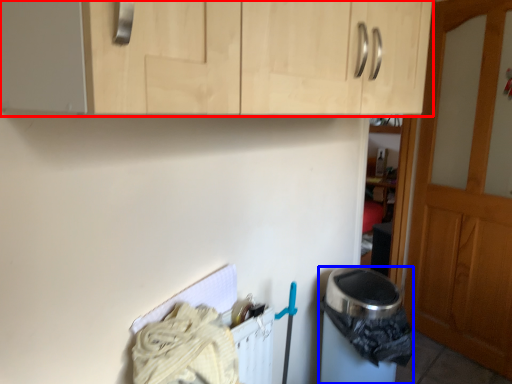
Question: Which of the following is the closest to the observer, cabinetry (highlighted by a red box) or appliance (highlighted by a blue box)?

Choices:
 (A) cabinetry
 (B) appliance

Answer: (A)